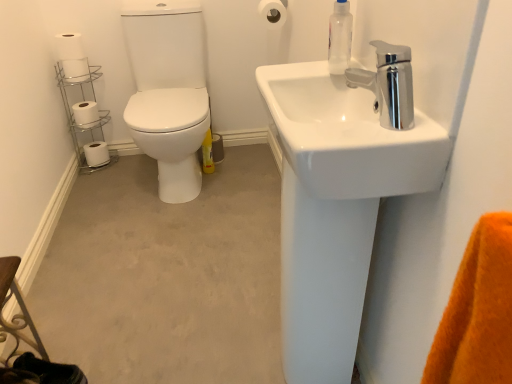
Question: Considering the positions of white glossy sink at upper right and white matte toilet paper at upper left, marked as the third toilet paper in a front-to-back arrangement, in the image, is white glossy sink at upper right bigger or smaller than white matte toilet paper at upper left, marked as the third toilet paper in a front-to-back arrangement,?

Choices:
 (A) small
 (B) big

Answer: (B)

Question: From a real-world perspective, relative to white matte toilet paper at upper left, placed as the 3th toilet paper when sorted from top to bottom, is white glossy sink at upper right vertically above or below?

Choices:
 (A) above
 (B) below

Answer: (A)

Question: Which of these objects is positioned farthest from the transparent plastic soap dispenser at upper right?

Choices:
 (A) white matte toilet paper at upper center, arranged as the 5th toilet paper when viewed from the back
 (B) chrome/metallic toilet paper holder at left
 (C) chrome metallic faucet at upper right
 (D) white matte toilet paper at upper left, the third toilet paper when ordered from back to front
 (E) white matte toilet paper at left, the fourth toilet paper positioned from the top

Answer: (E)

Question: Based on their relative distances, which object is nearer to the white matte toilet paper at upper left, the 5th toilet paper when ordered from bottom to top?

Choices:
 (A) white matte toilet paper at left, which ranks as the fourth toilet paper in right-to-left order
 (B) transparent plastic soap dispenser at upper right
 (C) white matte toilet paper at upper left, which is the 3th toilet paper in bottom-to-top order
 (D) chrome metallic faucet at upper right
 (E) white matte toilet paper at lower left, marked as the 1th toilet paper in a bottom-to-top arrangement

Answer: (C)